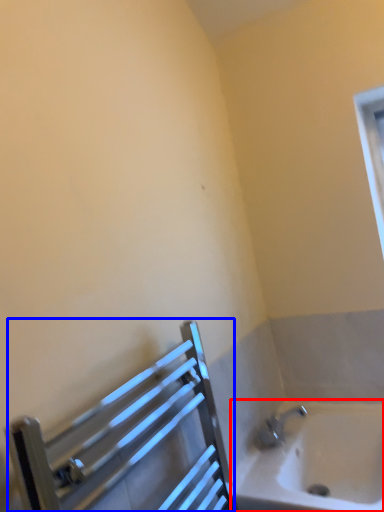
Question: Which of the following is the farthest to the observer, bathtub (highlighted by a red box) or balustrade (highlighted by a blue box)?

Choices:
 (A) bathtub
 (B) balustrade

Answer: (A)